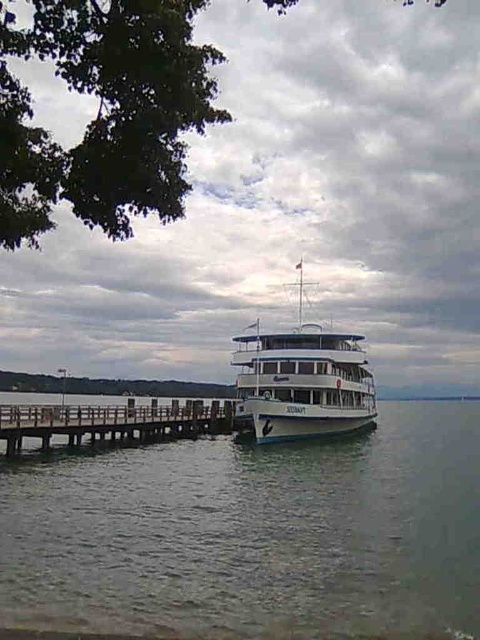
Question: Is clear water at dock right positioned behind brown wooden dock at lower left?

Choices:
 (A) no
 (B) yes

Answer: (A)

Question: Which of these objects is positioned farthest from the white glossy cruise ship at center?

Choices:
 (A) clear water at dock right
 (B) brown wooden dock at lower left

Answer: (B)

Question: Which point is closer to the camera?

Choices:
 (A) clear water at dock right
 (B) brown wooden dock at lower left

Answer: (A)

Question: Is clear water at dock right positioned behind white glossy cruise ship at center?

Choices:
 (A) yes
 (B) no

Answer: (B)

Question: Which of the following is the closest to the observer?

Choices:
 (A) (302, 413)
 (B) (336, 568)
 (C) (43, 422)

Answer: (B)

Question: Is white glossy cruise ship at center bigger than brown wooden dock at lower left?

Choices:
 (A) yes
 (B) no

Answer: (A)